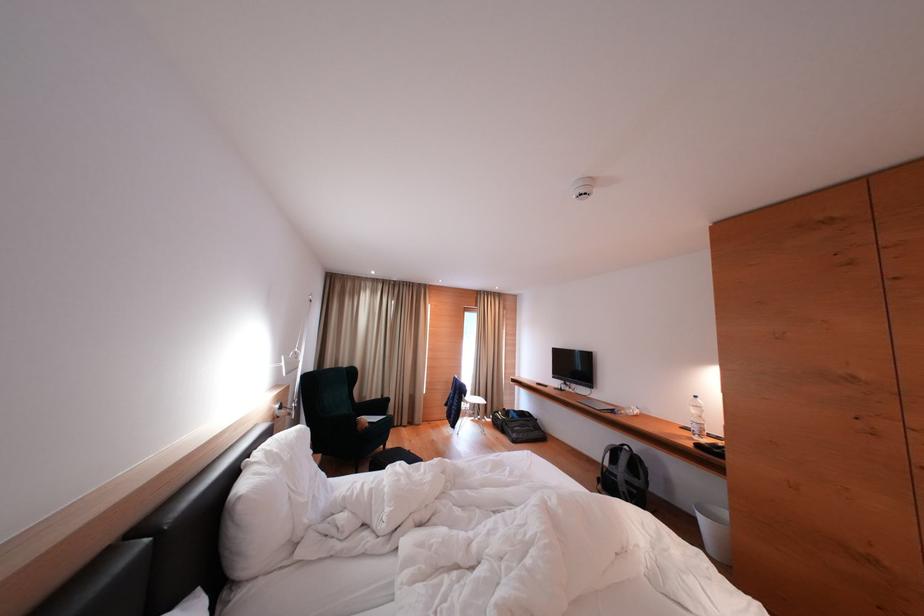
The image size is (924, 616). Identify the location of white stool surface. (472, 398).